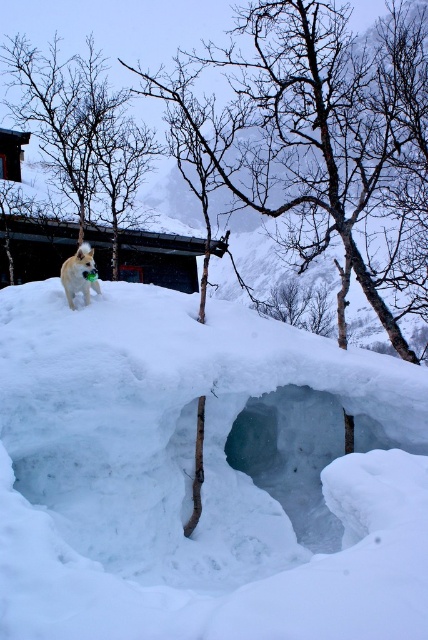
Question: Which of these objects is positioned farthest from the brown bark tree at upper left?

Choices:
 (A) white fluffy snow at upper center
 (B) fluffy white dog at upper left

Answer: (A)

Question: Considering the relative positions of brown bark tree at upper left and fluffy white dog at upper left in the image provided, where is brown bark tree at upper left located with respect to fluffy white dog at upper left?

Choices:
 (A) left
 (B) right

Answer: (A)

Question: Which is farther from the fluffy white dog at upper left?

Choices:
 (A) white fluffy snow at upper center
 (B) brown bark tree at upper left

Answer: (B)

Question: Is white fluffy snow at upper center wider than brown bark tree at upper left?

Choices:
 (A) yes
 (B) no

Answer: (B)

Question: Can you confirm if brown bark tree at upper left is thinner than fluffy white dog at upper left?

Choices:
 (A) no
 (B) yes

Answer: (A)

Question: Which point is farther from the camera taking this photo?

Choices:
 (A) [x=88, y=246]
 (B) [x=110, y=580]
 (C) [x=145, y=129]

Answer: (C)